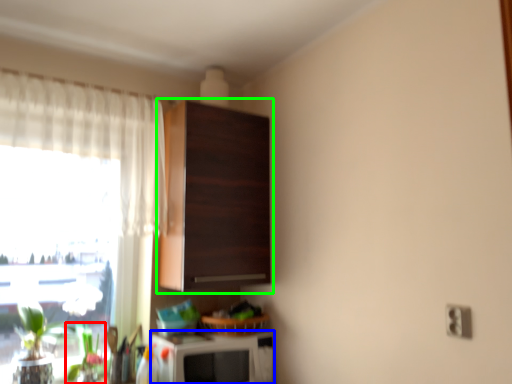
Question: Considering the real-world distances, which object is farthest from plant (highlighted by a red box)? appliance (highlighted by a blue box) or cabinetry (highlighted by a green box)?

Choices:
 (A) appliance
 (B) cabinetry

Answer: (B)